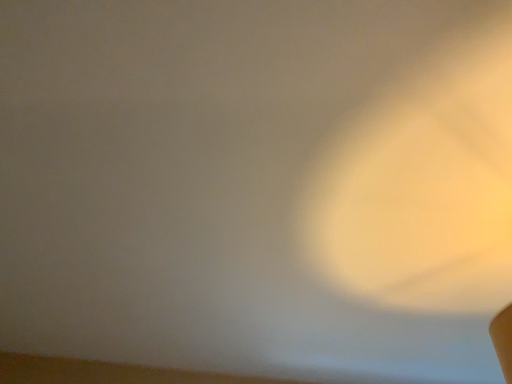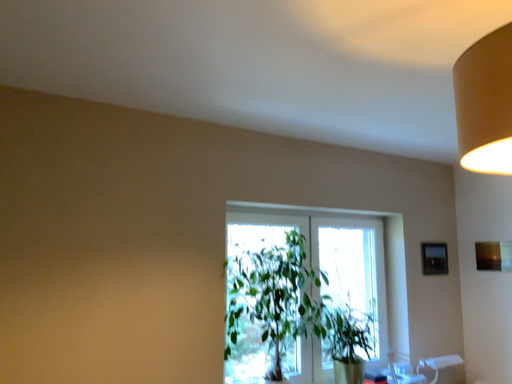
Question: Which way did the camera rotate in the video?

Choices:
 (A) rotated upward
 (B) rotated downward

Answer: (B)